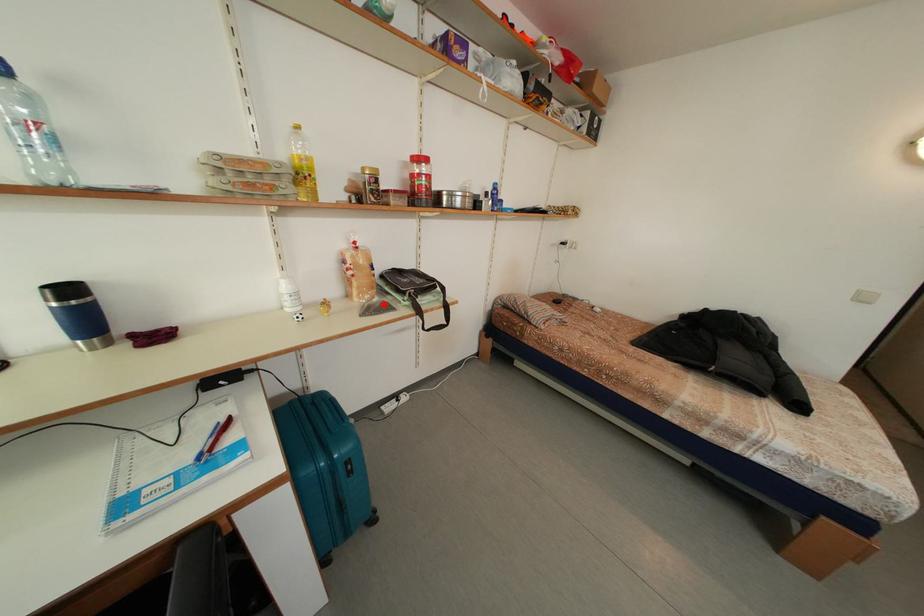
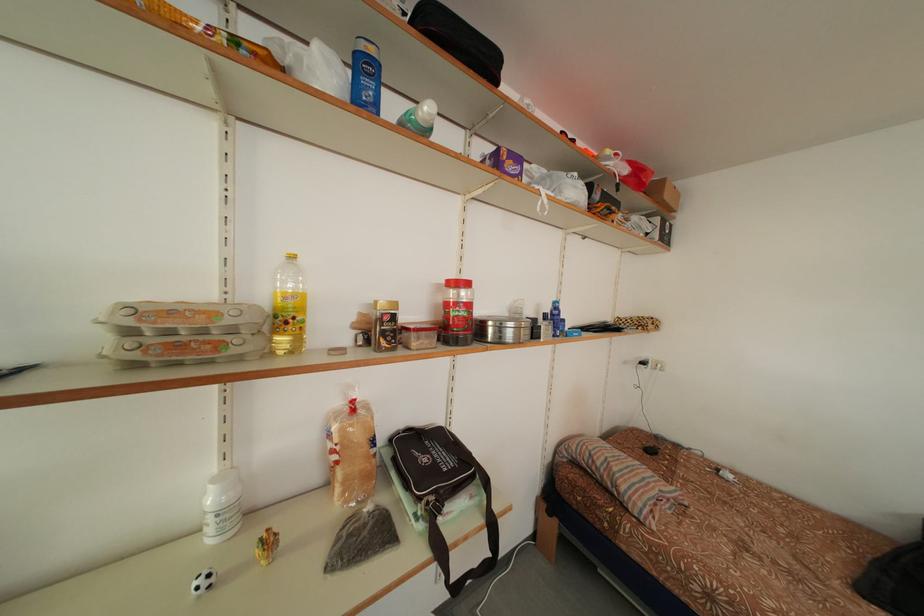
In the second image, find the point that corresponds to the highlighted location in the first image.

(378, 513)